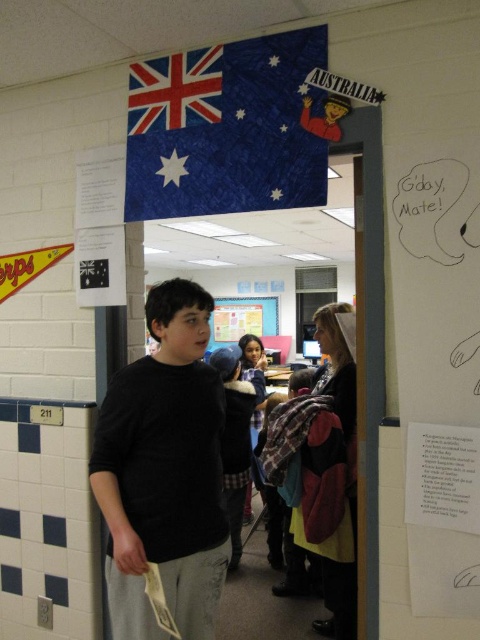
Is black matte shirt at center above plaid fabric shirt at center?

Indeed, black matte shirt at center is positioned over plaid fabric shirt at center.

Does black matte shirt at center have a lesser width compared to plaid fabric shirt at center?

No.

This screenshot has height=640, width=480. What do you see at coordinates (164, 472) in the screenshot? I see `black matte shirt at center` at bounding box center [164, 472].

Locate an element on the screen. Image resolution: width=480 pixels, height=640 pixels. black matte shirt at center is located at coordinates (164, 472).

Can you confirm if blue fabric flag at upper center is positioned to the right of plaid fabric shirt at center?

No, blue fabric flag at upper center is not to the right of plaid fabric shirt at center.

Who is positioned more to the left, blue fabric flag at upper center or plaid fabric shirt at center?

blue fabric flag at upper center

Is point (148, 211) positioned behind point (240, 428)?

No, it is in front of (240, 428).

You are a GUI agent. You are given a task and a screenshot of the screen. Output one action in this format:
    pyautogui.click(x=<x>, y=<y>)
    Task: Click on the blue fabric flag at upper center
    The width and height of the screenshot is (480, 640).
    Given the screenshot: What is the action you would take?
    pyautogui.click(x=228, y=129)

Does black matte shirt at center lie in front of blue fabric flag at upper center?

Yes, it is.

Which is behind, point (134, 563) or point (309, 202)?

The point (309, 202) is behind.

Find the location of `black matte shirt at center`. black matte shirt at center is located at coordinates (164, 472).